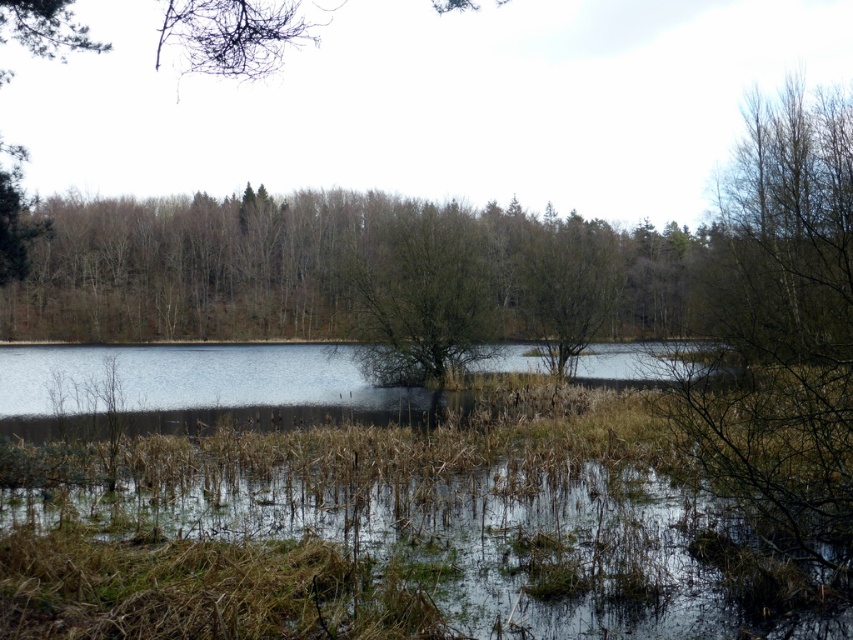
Question: Does green matte tree at center appear on the right side of brown matte tree at center?

Choices:
 (A) no
 (B) yes

Answer: (A)

Question: Where is green matte tree at center located in relation to brown matte tree at center in the image?

Choices:
 (A) below
 (B) above

Answer: (B)

Question: Can you confirm if green matte tree at center is positioned above brown matte tree at center?

Choices:
 (A) yes
 (B) no

Answer: (A)

Question: Which of the following is the closest to the observer?

Choices:
 (A) (558, 323)
 (B) (421, 292)

Answer: (B)